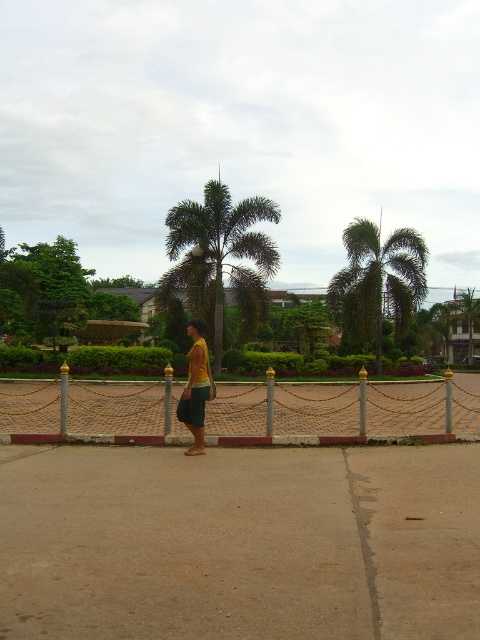
You are a delivery person trying to park your 1.5 meter wide cart between the brown concrete pavement at center and the green leafy palm tree at center. Can your cart fit in the space between them?

The brown concrete pavement at center is narrower than the green leafy palm tree at center, but the description only compares their widths, not the space between them. Without specific distance information, it is impossible to determine if the cart will fit.

You are standing at the point marked by the coordinates point (208, 248). You want to walk directly towards the viewer. How far will you have to walk to reach the viewer?

You will have to walk 85.10 feet to reach the viewer because the distance between point (208, 248) and the viewer is 85.10 feet.